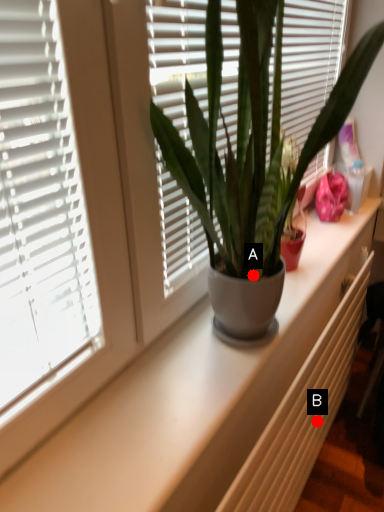
Question: Two points are circled on the image, labeled by A and B beside each circle. Which point is farther from the camera taking this photo?

Choices:
 (A) A is further
 (B) B is further

Answer: (B)